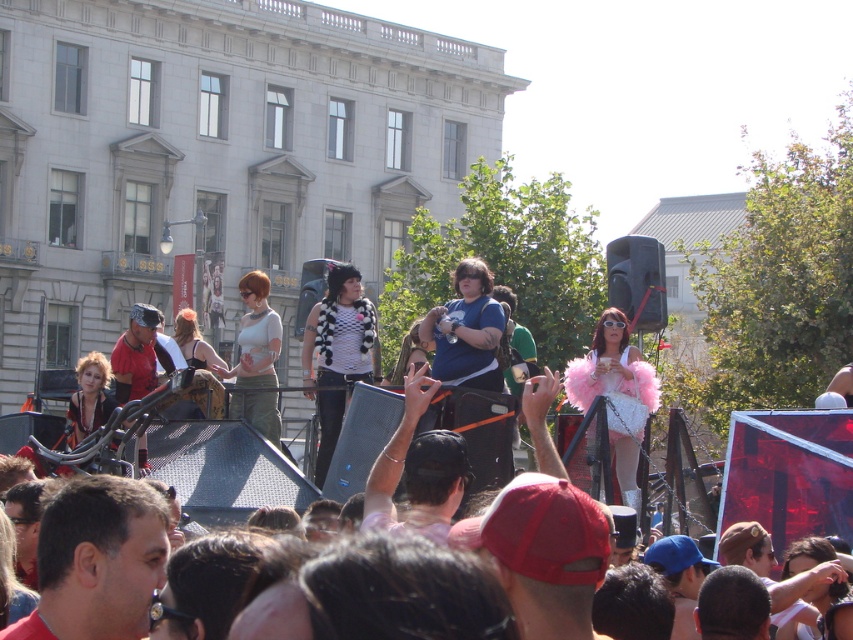
Who is shorter, black and white fur vest at center or matte black cap at center?

Standing shorter between the two is matte black cap at center.

Consider the image. Measure the distance between black and white fur vest at center and matte black cap at center.

They are 6.10 meters apart.

Locate an element on the screen. black and white fur vest at center is located at coordinates click(341, 333).

Who is positioned more to the left, matte red cap at center or dark brown leather jacket at center?

Positioned to the left is matte red cap at center.

This screenshot has width=853, height=640. What do you see at coordinates (97, 561) in the screenshot?
I see `matte red cap at center` at bounding box center [97, 561].

I want to click on matte red cap at center, so click(x=97, y=561).

Does matte red cap at center lie in front of black and white fur vest at center?

Yes, it is.

Is matte red cap at center to the right of black and white fur vest at center from the viewer's perspective?

Incorrect, matte red cap at center is not on the right side of black and white fur vest at center.

Does point (82, 548) come closer to viewer compared to point (357, 278)?

Yes, point (82, 548) is in front of point (357, 278).

You are a GUI agent. You are given a task and a screenshot of the screen. Output one action in this format:
    pyautogui.click(x=<x>, y=<y>)
    Task: Click on the matte red cap at center
    The image size is (853, 640).
    Given the screenshot: What is the action you would take?
    pyautogui.click(x=97, y=561)